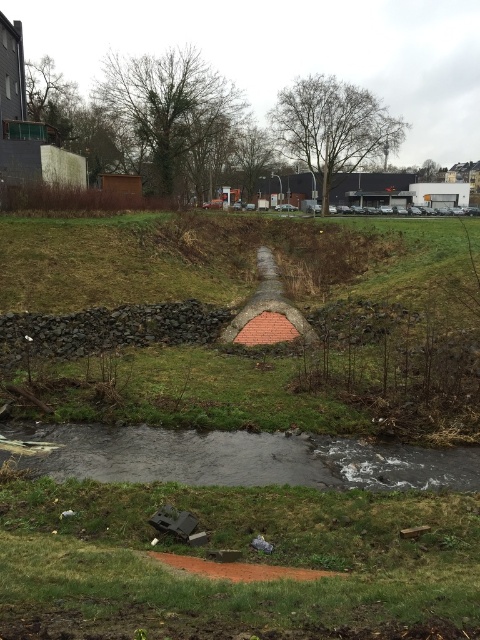
You are a gardener who needs to water the green grass at center using a hose that can reach 3 meters. Can you water it without moving the hose from its current position near the gray smooth stream at lower center?

The distance between the green grass at center and the gray smooth stream at lower center is 3.26 meters. Since the hose can only reach 3 meters, you cannot water the green grass at center without moving the hose closer.

You are a gardener assessing the growth of green grass at center and green grass at lower center in the outdoor scene. Which area has wider grass coverage?

The green grass at center has wider grass coverage than the green grass at lower center because its width surpasses the latter.

You are a gardener who needs to mow the lawn. You see two areas of green grass at center and green grass at lower center. Which area requires mowing first based on their height?

The green grass at center requires mowing first because it is taller than the green grass at lower center.